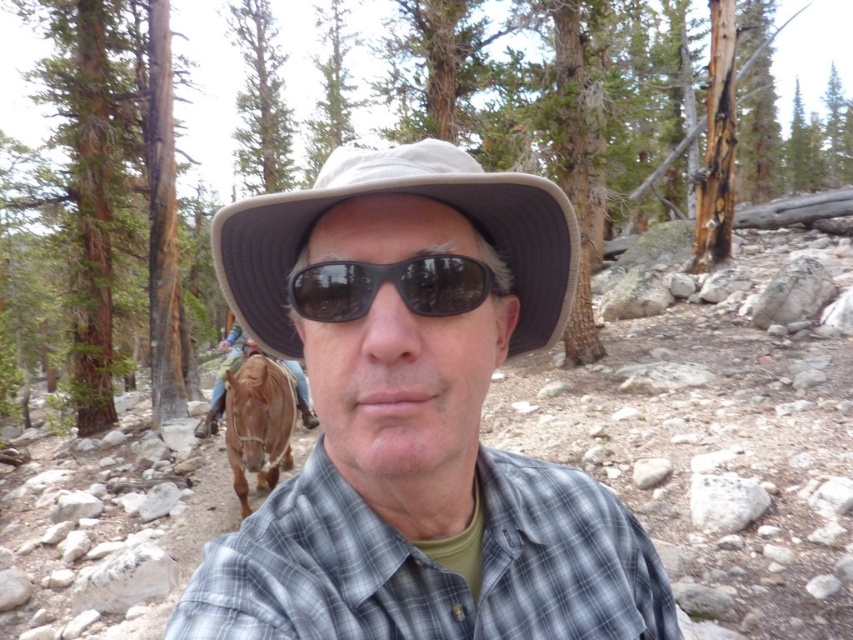
You are a hiker who has just arrived at this forest area. You notice the plaid fabric shirt at center and the brown bark tree at left. Which object is taller from your viewpoint?

The plaid fabric shirt at center is taller than the brown bark tree at left.

You are a photographer trying to capture the gray checkered shirt at center in your shot. Based on the coordinates provided, where should you position your camera to ensure the shirt is centered in the frame?

The gray checkered shirt at center is located at coordinates point (431, 566), so positioning the camera to center the frame at those coordinates will ensure the shirt is centered.

You are a hiker who wants to take a photo of the plaid fabric shirt at center and the brown bark tree at left. Which object should you focus on first to ensure both are in the frame?

The plaid fabric shirt at center is in front of the brown bark tree at left, so you should focus on the brown bark tree at left first to ensure both are in the frame.